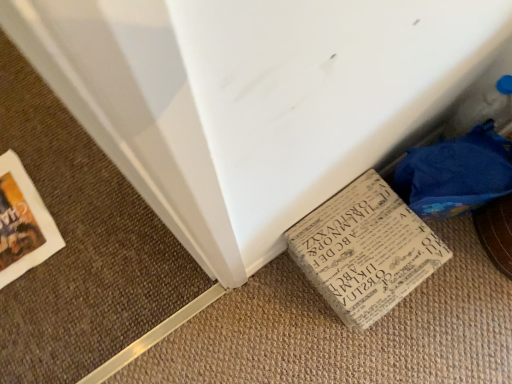
Identify the location of printed paper book at lower right. This screenshot has width=512, height=384. (365, 250).

The width and height of the screenshot is (512, 384). Describe the element at coordinates (365, 250) in the screenshot. I see `printed paper book at lower right` at that location.

You are a GUI agent. You are given a task and a screenshot of the screen. Output one action in this format:
    pyautogui.click(x=<x>, y=<y>)
    Task: Click on the white paper puzzle at lower right
    
    Given the screenshot: What is the action you would take?
    pyautogui.click(x=456, y=173)

Describe the element at coordinates (456, 173) in the screenshot. Image resolution: width=512 pixels, height=384 pixels. I see `white paper puzzle at lower right` at that location.

You are a GUI agent. You are given a task and a screenshot of the screen. Output one action in this format:
    pyautogui.click(x=<x>, y=<y>)
    Task: Click on the printed paper book at lower right
    
    Given the screenshot: What is the action you would take?
    pyautogui.click(x=365, y=250)

Considering the positions of objects printed paper book at lower right and white paper puzzle at lower right in the image provided, who is more to the left, printed paper book at lower right or white paper puzzle at lower right?

printed paper book at lower right.

In the scene shown: Between printed paper book at lower right and white paper puzzle at lower right, which one is positioned in front?

white paper puzzle at lower right is in front.

Is point (415, 228) more distant than point (471, 174)?

Yes, point (415, 228) is farther from viewer.

Consider the image. From the image's perspective, is printed paper book at lower right above or below white paper puzzle at lower right?

printed paper book at lower right is below white paper puzzle at lower right.

From a real-world perspective, between printed paper book at lower right and white paper puzzle at lower right, who is vertically higher?

In real-world perspective, white paper puzzle at lower right is above.

Can you confirm if printed paper book at lower right is thinner than white paper puzzle at lower right?

No.

Who is shorter, printed paper book at lower right or white paper puzzle at lower right?

printed paper book at lower right.

Who is smaller, printed paper book at lower right or white paper puzzle at lower right?

white paper puzzle at lower right is smaller.

Is printed paper book at lower right positioned beyond the bounds of white paper puzzle at lower right?

Absolutely, printed paper book at lower right is external to white paper puzzle at lower right.

Is there a large distance between printed paper book at lower right and white paper puzzle at lower right?

No, printed paper book at lower right is not far away from white paper puzzle at lower right.

Could you tell me if printed paper book at lower right is facing white paper puzzle at lower right?

No, printed paper book at lower right is not facing towards white paper puzzle at lower right.

Measure the distance between printed paper book at lower right and white paper puzzle at lower right.

The distance of printed paper book at lower right from white paper puzzle at lower right is 12.39 centimeters.

This screenshot has height=384, width=512. What are the coordinates of `book lying behind the white paper puzzle at lower right` in the screenshot? It's located at (365, 250).

Which object is positioned more to the right, white paper puzzle at lower right or printed paper book at lower right?

white paper puzzle at lower right.

Is white paper puzzle at lower right further to camera compared to printed paper book at lower right?

No.

Does point (458, 212) come in front of point (335, 241)?

No, it is behind (335, 241).

From the image's perspective, is white paper puzzle at lower right located beneath printed paper book at lower right?

No, from the image's perspective, white paper puzzle at lower right is not beneath printed paper book at lower right.

From a real-world perspective, which is physically below, white paper puzzle at lower right or printed paper book at lower right?

printed paper book at lower right, from a real-world perspective.

Which object is thinner, white paper puzzle at lower right or printed paper book at lower right?

white paper puzzle at lower right is thinner.

Between white paper puzzle at lower right and printed paper book at lower right, which one has more height?

white paper puzzle at lower right is taller.

Considering the sizes of objects white paper puzzle at lower right and printed paper book at lower right in the image provided, who is bigger, white paper puzzle at lower right or printed paper book at lower right?

printed paper book at lower right.

Is printed paper book at lower right a part of white paper puzzle at lower right?

No, printed paper book at lower right is located outside of white paper puzzle at lower right.

Is white paper puzzle at lower right not near printed paper book at lower right?

Actually, white paper puzzle at lower right and printed paper book at lower right are a little close together.

Is printed paper book at lower right at the back of white paper puzzle at lower right?

white paper puzzle at lower right does not have its back to printed paper book at lower right.

How different are the orientations of white paper puzzle at lower right and printed paper book at lower right in degrees?

The facing directions of white paper puzzle at lower right and printed paper book at lower right are 0.00153 degrees apart.

This screenshot has height=384, width=512. Find the location of `book beneath the white paper puzzle at lower right (from a real-world perspective)`. book beneath the white paper puzzle at lower right (from a real-world perspective) is located at coordinates (365, 250).

Find the location of a particular element. This screenshot has width=512, height=384. material above the printed paper book at lower right (from a real-world perspective) is located at coordinates (456, 173).

What are the coordinates of `material on the right of printed paper book at lower right` in the screenshot? It's located at (456, 173).